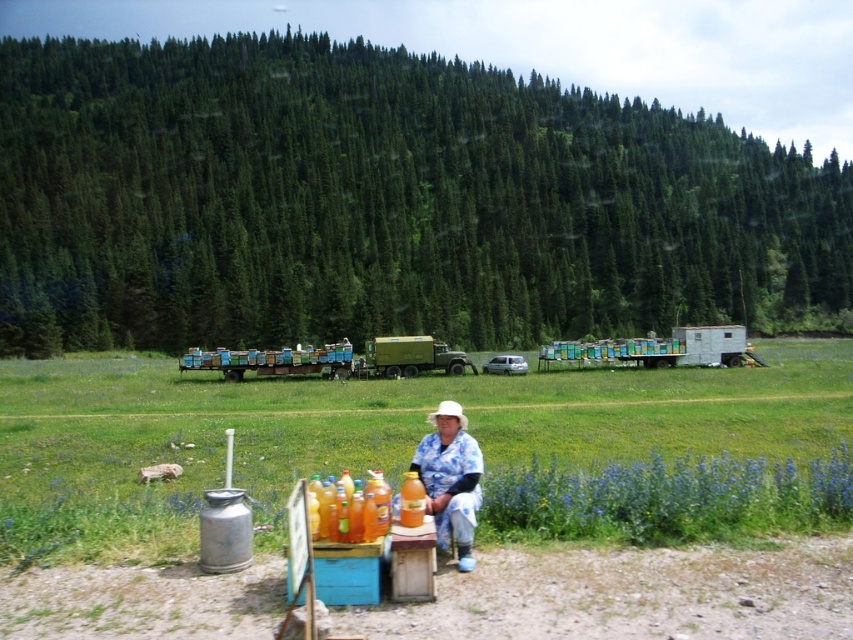
Can you confirm if metallic canister at lower left is thinner than blue floral shirt at center?

Incorrect, metallic canister at lower left's width is not less than blue floral shirt at center's.

Is point (761, 388) positioned after point (450, 433)?

Yes, point (761, 388) is behind point (450, 433).

Where is `metallic canister at lower left`? The image size is (853, 640). metallic canister at lower left is located at coordinates (364, 435).

Which is more to the left, metallic canister at lower left or wooden beehives at center?

Positioned to the left is wooden beehives at center.

The height and width of the screenshot is (640, 853). What are the coordinates of `metallic canister at lower left` in the screenshot? It's located at (364, 435).

You are a GUI agent. You are given a task and a screenshot of the screen. Output one action in this format:
    pyautogui.click(x=<x>, y=<y>)
    Task: Click on the metallic canister at lower left
    
    Given the screenshot: What is the action you would take?
    pyautogui.click(x=364, y=435)

Does blue floral shirt at center appear over wooden beehives at center?

Indeed, blue floral shirt at center is positioned over wooden beehives at center.

Does blue floral shirt at center appear on the right side of wooden beehives at center?

Correct, you'll find blue floral shirt at center to the right of wooden beehives at center.

What do you see at coordinates (450, 477) in the screenshot?
I see `blue floral shirt at center` at bounding box center [450, 477].

Locate an element on the screen. blue floral shirt at center is located at coordinates (450, 477).